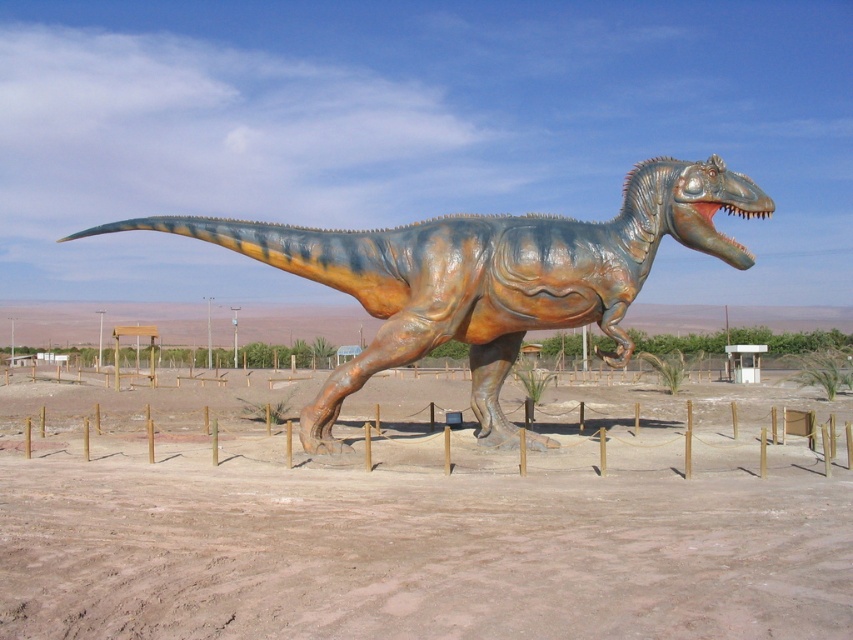
Which is more to the right, brown sandy dirt at center or shiny bronze dinosaur at center?

Positioned to the right is brown sandy dirt at center.

In the scene shown: Between brown sandy dirt at center and shiny bronze dinosaur at center, which one has more height?

With more height is shiny bronze dinosaur at center.

I want to click on brown sandy dirt at center, so click(422, 524).

The width and height of the screenshot is (853, 640). I want to click on brown sandy dirt at center, so click(422, 524).